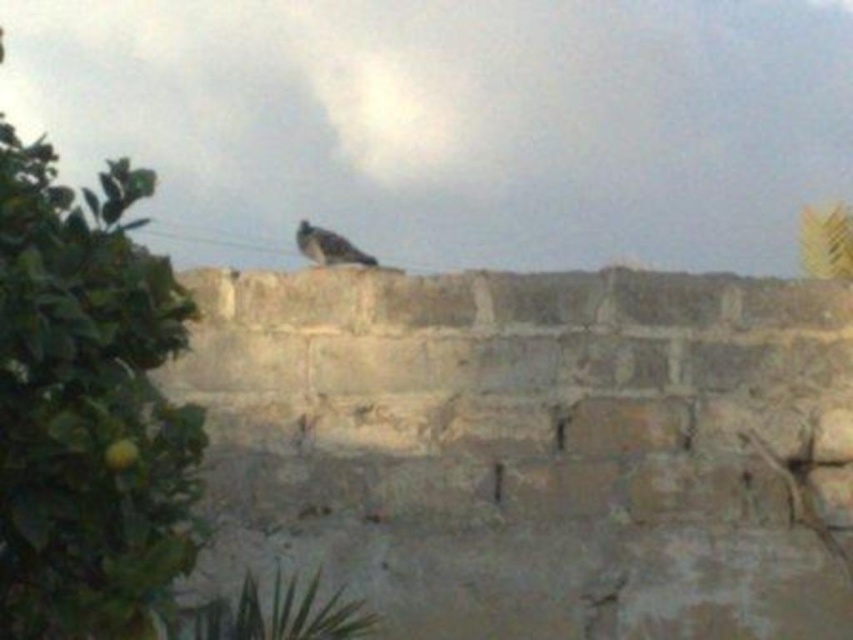
Question: Can you confirm if green leafy tree at left is bigger than gray feathered bird at center?

Choices:
 (A) yes
 (B) no

Answer: (A)

Question: Where is green leafy tree at left located in relation to gray feathered bird at center in the image?

Choices:
 (A) above
 (B) below

Answer: (B)

Question: Among these points, which one is farthest from the camera?

Choices:
 (A) (321, 243)
 (B) (155, 499)

Answer: (A)

Question: Which point is closer to the camera taking this photo?

Choices:
 (A) (142, 580)
 (B) (305, 250)

Answer: (A)

Question: Does green leafy tree at left have a greater width compared to gray feathered bird at center?

Choices:
 (A) no
 (B) yes

Answer: (B)

Question: Among these points, which one is farthest from the camera?

Choices:
 (A) (306, 240)
 (B) (128, 333)

Answer: (A)